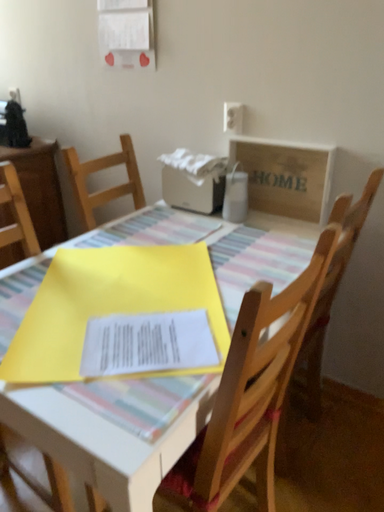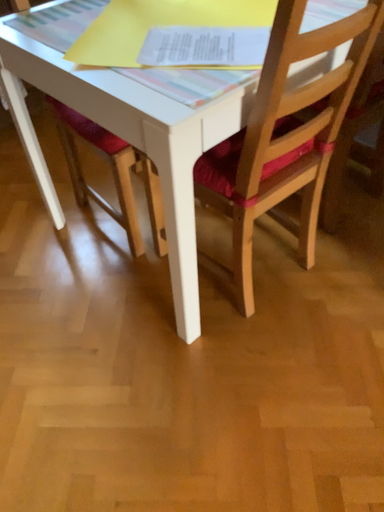
Question: How did the camera likely rotate when shooting the video?

Choices:
 (A) rotated upward
 (B) rotated downward

Answer: (B)